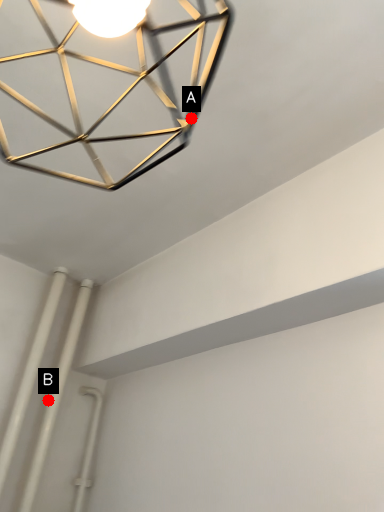
Question: Two points are circled on the image, labeled by A and B beside each circle. Which point appears farthest from the camera in this image?

Choices:
 (A) A is further
 (B) B is further

Answer: (B)